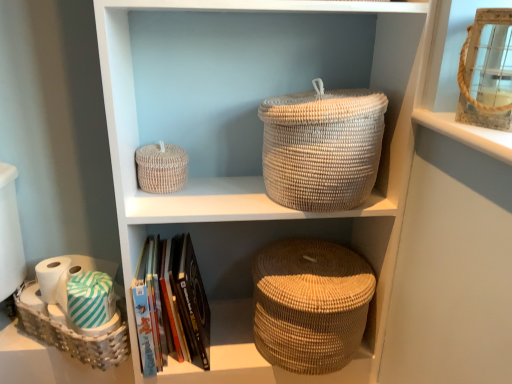
What do you see at coordinates (73, 336) in the screenshot?
I see `white woven basket at lower left, placed as the 3th basket when sorted from right to left` at bounding box center [73, 336].

The height and width of the screenshot is (384, 512). Describe the element at coordinates (322, 147) in the screenshot. I see `white woven basket at upper center, placed as the first basket when sorted from right to left` at that location.

What do you see at coordinates (90, 300) in the screenshot? Image resolution: width=512 pixels, height=384 pixels. I see `green striped fabric at lower left, which appears as the second toilet paper when viewed from the left` at bounding box center [90, 300].

Based on the photo, how much space does green striped fabric at lower left, which appears as the 1th toilet paper when viewed from the right, occupy horizontally?

green striped fabric at lower left, which appears as the 1th toilet paper when viewed from the right, is 12.82 centimeters in width.

Find the location of a particular element. This screenshot has width=512, height=384. woven beige basket at upper left, the 2th basket positioned from the left is located at coordinates (161, 168).

Who is bigger, green striped fabric at lower left, which appears as the 1th toilet paper when viewed from the right, or woven beige basket at upper left, acting as the 2th basket starting from the right?

woven beige basket at upper left, acting as the 2th basket starting from the right.

Measure the distance from green striped fabric at lower left, which appears as the second toilet paper when viewed from the left, to woven beige basket at upper left, the 2th basket positioned from the left.

green striped fabric at lower left, which appears as the second toilet paper when viewed from the left, and woven beige basket at upper left, the 2th basket positioned from the left, are 33.50 centimeters apart.

Between green striped fabric at lower left, which appears as the second toilet paper when viewed from the left, and woven beige basket at upper left, acting as the 2th basket starting from the right, which one has less height?

green striped fabric at lower left, which appears as the second toilet paper when viewed from the left.

Considering the sizes of objects green striped fabric at lower left, which appears as the second toilet paper when viewed from the left, and woven beige basket at upper left, which is the 2th basket from bottom to top, in the image provided, who is thinner, green striped fabric at lower left, which appears as the second toilet paper when viewed from the left, or woven beige basket at upper left, which is the 2th basket from bottom to top,?

green striped fabric at lower left, which appears as the second toilet paper when viewed from the left, is thinner.

Is brown woven basket at lower center completely or partially outside of woven beige basket at upper left, which is the 2th basket from bottom to top?

brown woven basket at lower center is positioned outside woven beige basket at upper left, which is the 2th basket from bottom to top.

Is brown woven basket at lower center taller than woven beige basket at upper left, acting as the second basket starting from the top?

Indeed, brown woven basket at lower center has a greater height compared to woven beige basket at upper left, acting as the second basket starting from the top.

Consider the image. What's the angular difference between brown woven basket at lower center and woven beige basket at upper left, which is the 2th basket from bottom to top,'s facing directions?

The angle between the facing direction of brown woven basket at lower center and the facing direction of woven beige basket at upper left, which is the 2th basket from bottom to top, is 1.27 degrees.

In the scene shown: From the image's perspective, does brown woven basket at lower center appear higher than woven beige basket at upper left, acting as the second basket starting from the top?

No, from the image's perspective, brown woven basket at lower center is not above woven beige basket at upper left, acting as the second basket starting from the top.

Would you say white matte toilet paper at lower left, which ranks as the 1th toilet paper in left-to-right order, is a long distance from green striped fabric at lower left, which appears as the 1th toilet paper when viewed from the right?

That's not correct — white matte toilet paper at lower left, which ranks as the 1th toilet paper in left-to-right order, is a little close to green striped fabric at lower left, which appears as the 1th toilet paper when viewed from the right.

Can you confirm if white matte toilet paper at lower left, which ranks as the 1th toilet paper in left-to-right order, is positioned to the right of green striped fabric at lower left, which appears as the 1th toilet paper when viewed from the right?

No.

From their relative heights in the image, would you say white matte toilet paper at lower left, which ranks as the 1th toilet paper in left-to-right order, is taller or shorter than green striped fabric at lower left, which appears as the 1th toilet paper when viewed from the right?

In the image, white matte toilet paper at lower left, which ranks as the 1th toilet paper in left-to-right order, appears to be shorter than green striped fabric at lower left, which appears as the 1th toilet paper when viewed from the right.

Is point (72, 260) closer or farther from the camera than point (82, 293)?

Point (72, 260).

Is white matte toilet paper at lower left, which ranks as the 1th toilet paper in left-to-right order, positioned with its back to natural woven basket at center?

No, white matte toilet paper at lower left, which ranks as the 1th toilet paper in left-to-right order, is not facing away from natural woven basket at center.

Which object is positioned more to the right, white matte toilet paper at lower left, the second toilet paper from the right, or natural woven basket at center?

natural woven basket at center.

Which object is closer to the camera taking this photo, white matte toilet paper at lower left, which ranks as the 1th toilet paper in left-to-right order, or natural woven basket at center?

Positioned in front is natural woven basket at center.

Is white woven basket at upper center, which appears as the third basket when ordered from the bottom, turned away from woven beige basket at upper left, the 2th basket positioned from the left?

That's not correct — white woven basket at upper center, which appears as the third basket when ordered from the bottom, is not looking away from woven beige basket at upper left, the 2th basket positioned from the left.

From the image's perspective, is white woven basket at upper center, which appears as the third basket when ordered from the bottom, above or below woven beige basket at upper left, which is the 2th basket from bottom to top?

From the image's perspective, white woven basket at upper center, which appears as the third basket when ordered from the bottom, appears above woven beige basket at upper left, which is the 2th basket from bottom to top.

How many degrees apart are the facing directions of white woven basket at upper center, the 3th basket in the left-to-right sequence, and woven beige basket at upper left, the 2th basket positioned from the left?

The angular difference between white woven basket at upper center, the 3th basket in the left-to-right sequence, and woven beige basket at upper left, the 2th basket positioned from the left, is 6.11 degrees.

From a real-world perspective, count 1st baskets downward from the white woven basket at upper center, marked as the 1th basket in a top-to-bottom arrangement, and point to it. Please provide its 2D coordinates.

[(161, 168)]

Can you see white woven basket at lower left, placed as the 3th basket when sorted from right to left, touching white woven basket at upper center, placed as the first basket when sorted from right to left?

white woven basket at lower left, placed as the 3th basket when sorted from right to left, and white woven basket at upper center, placed as the first basket when sorted from right to left, are clearly separated.

From a real-world perspective, is white woven basket at lower left, acting as the 1th basket starting from the left, located beneath white woven basket at upper center, marked as the 1th basket in a top-to-bottom arrangement?

Yes, from a real-world perspective, white woven basket at lower left, acting as the 1th basket starting from the left, is below white woven basket at upper center, marked as the 1th basket in a top-to-bottom arrangement.

This screenshot has width=512, height=384. Identify the location of the 2nd basket to the right when counting from the white woven basket at lower left, placed as the 3th basket when sorted from right to left. (322, 147).

Does white woven basket at lower left, placed as the 3th basket when sorted from right to left, contain white woven basket at upper center, the 3th basket in the left-to-right sequence?

Actually, white woven basket at upper center, the 3th basket in the left-to-right sequence, is outside white woven basket at lower left, placed as the 3th basket when sorted from right to left.

From a real-world perspective, which is physically above, white woven basket at upper center, which appears as the third basket when ordered from the bottom, or white woven basket at lower left, acting as the 1th basket starting from the left?

white woven basket at upper center, which appears as the third basket when ordered from the bottom, is physically above.

Considering their positions, is white woven basket at upper center, the 3th basket in the left-to-right sequence, located in front of or behind white woven basket at lower left, the first basket positioned from the bottom?

In the image, white woven basket at upper center, the 3th basket in the left-to-right sequence, appears in front of white woven basket at lower left, the first basket positioned from the bottom.

Find the location of a particular element. The width and height of the screenshot is (512, 384). basket that is the 2nd object located below the white woven basket at upper center, which appears as the third basket when ordered from the bottom (from the image's perspective) is located at coordinates (73, 336).

How distant is white woven basket at upper center, which appears as the third basket when ordered from the bottom, from white woven basket at lower left, the first basket positioned from the bottom?

A distance of 27.70 inches exists between white woven basket at upper center, which appears as the third basket when ordered from the bottom, and white woven basket at lower left, the first basket positioned from the bottom.

Where is `basket behind the green striped fabric at lower left, which appears as the 1th toilet paper when viewed from the right`? The image size is (512, 384). basket behind the green striped fabric at lower left, which appears as the 1th toilet paper when viewed from the right is located at coordinates (161, 168).

At what (x,y) coordinates should I click in order to perform the action: click on basket container below the woven beige basket at upper left, which is the 2th basket from bottom to top (from the image's perspective). Please return your answer as a coordinate pair (x, y). Looking at the image, I should click on (310, 304).

Considering their positions, is white woven basket at upper center, placed as the first basket when sorted from right to left, positioned closer to white woven basket at lower left, the first basket positioned from the bottom, than brown woven basket at lower center?

Among the two, brown woven basket at lower center is located nearer to white woven basket at lower left, the first basket positioned from the bottom.

Looking at the image, which one is located further to natural woven basket at center, white matte toilet paper at lower left, the second toilet paper from the right, or white woven basket at lower left, acting as the 1th basket starting from the left?

white matte toilet paper at lower left, the second toilet paper from the right, is further to natural woven basket at center.

Looking at this image, estimate the real-world distances between objects in this image. Which object is further from woven beige basket at upper left, the 2th basket positioned from the left, brown woven basket at lower center or green striped fabric at lower left, which appears as the 1th toilet paper when viewed from the right?

brown woven basket at lower center is further to woven beige basket at upper left, the 2th basket positioned from the left.

Which object lies further to the anchor point green striped fabric at lower left, which appears as the second toilet paper when viewed from the left, woven beige basket at upper left, which is the 2th basket from bottom to top, or natural woven basket at center?

The object further to green striped fabric at lower left, which appears as the second toilet paper when viewed from the left, is natural woven basket at center.

Looking at the image, which one is located further to woven beige basket at upper left, the 2th basket positioned from the left, natural woven basket at center or brown woven basket at lower center?

brown woven basket at lower center.

Looking at the image, which one is located closer to natural woven basket at center, white woven basket at upper center, which appears as the third basket when ordered from the bottom, or white woven basket at lower left, placed as the 3th basket when sorted from right to left?

white woven basket at upper center, which appears as the third basket when ordered from the bottom, is closer to natural woven basket at center.

Which object lies nearer to the anchor point white matte toilet paper at lower left, the second toilet paper from the right, white woven basket at upper center, marked as the 1th basket in a top-to-bottom arrangement, or white woven basket at lower left, acting as the third basket starting from the top?

white woven basket at lower left, acting as the third basket starting from the top, is closer to white matte toilet paper at lower left, the second toilet paper from the right.

Considering their positions, is white woven basket at upper center, placed as the first basket when sorted from right to left, positioned closer to white matte toilet paper at lower left, which ranks as the 1th toilet paper in left-to-right order, than green striped fabric at lower left, which appears as the second toilet paper when viewed from the left?

green striped fabric at lower left, which appears as the second toilet paper when viewed from the left, is positioned closer to the anchor white matte toilet paper at lower left, which ranks as the 1th toilet paper in left-to-right order.

Where is `toilet paper between white matte toilet paper at lower left, the second toilet paper from the right, and brown woven basket at lower center`? toilet paper between white matte toilet paper at lower left, the second toilet paper from the right, and brown woven basket at lower center is located at coordinates (90, 300).

Locate an element on the screen. Image resolution: width=512 pixels, height=384 pixels. basket located between green striped fabric at lower left, which appears as the 1th toilet paper when viewed from the right, and natural woven basket at center in the left-right direction is located at coordinates (161, 168).

Find the location of a particular element. This screenshot has height=384, width=512. toilet paper between white matte toilet paper at lower left, which ranks as the 1th toilet paper in left-to-right order, and white woven basket at lower left, acting as the third basket starting from the top, from top to bottom is located at coordinates (90, 300).

The height and width of the screenshot is (384, 512). In order to click on shelf between white matte toilet paper at lower left, which ranks as the 1th toilet paper in left-to-right order, and brown woven basket at lower center in this screenshot , I will do `click(260, 191)`.